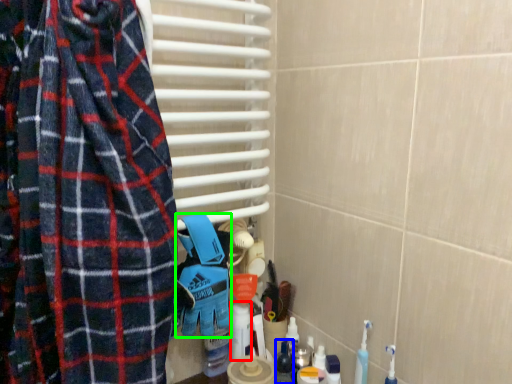
Question: Which object is the closest to the cleaning product (highlighted by a red box)? Choose among these: toiletry (highlighted by a blue box) or blanket (highlighted by a green box).

Choices:
 (A) toiletry
 (B) blanket

Answer: (A)